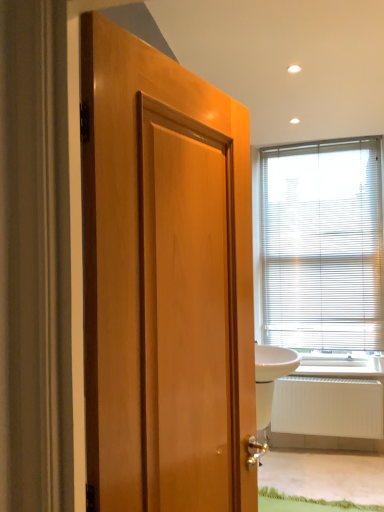
Question: Is white plastic blinds at upper right completely or partially outside of wooden door at center?

Choices:
 (A) yes
 (B) no

Answer: (A)

Question: Can you confirm if white plastic blinds at upper right is wider than wooden door at center?

Choices:
 (A) yes
 (B) no

Answer: (B)

Question: From the image's perspective, is white plastic blinds at upper right above wooden door at center?

Choices:
 (A) no
 (B) yes

Answer: (B)

Question: Is wooden door at center a part of white plastic blinds at upper right?

Choices:
 (A) no
 (B) yes

Answer: (A)

Question: Considering the relative sizes of white plastic blinds at upper right and wooden door at center in the image provided, is white plastic blinds at upper right smaller than wooden door at center?

Choices:
 (A) no
 (B) yes

Answer: (A)

Question: Is wooden door at center inside or outside of white glossy sink at right?

Choices:
 (A) inside
 (B) outside

Answer: (B)

Question: From the image's perspective, is wooden door at center above or below white glossy sink at right?

Choices:
 (A) above
 (B) below

Answer: (A)

Question: Is wooden door at center taller or shorter than white glossy sink at right?

Choices:
 (A) short
 (B) tall

Answer: (B)

Question: Would you say wooden door at center is to the left or to the right of white glossy sink at right in the picture?

Choices:
 (A) left
 (B) right

Answer: (A)

Question: Would you say white plastic blinds at upper right is inside or outside wooden door at center?

Choices:
 (A) inside
 (B) outside

Answer: (B)

Question: Would you say white plastic blinds at upper right is to the left or to the right of wooden door at center in the picture?

Choices:
 (A) right
 (B) left

Answer: (A)

Question: Does point (337, 324) appear closer or farther from the camera than point (165, 194)?

Choices:
 (A) farther
 (B) closer

Answer: (A)

Question: In terms of size, does white plastic blinds at upper right appear bigger or smaller than wooden door at center?

Choices:
 (A) small
 (B) big

Answer: (B)

Question: Looking at the image, does wooden door at center seem bigger or smaller compared to white matte radiator at lower right?

Choices:
 (A) small
 (B) big

Answer: (A)

Question: Considering the relative positions of wooden door at center and white matte radiator at lower right in the image provided, is wooden door at center to the left or to the right of white matte radiator at lower right?

Choices:
 (A) left
 (B) right

Answer: (A)